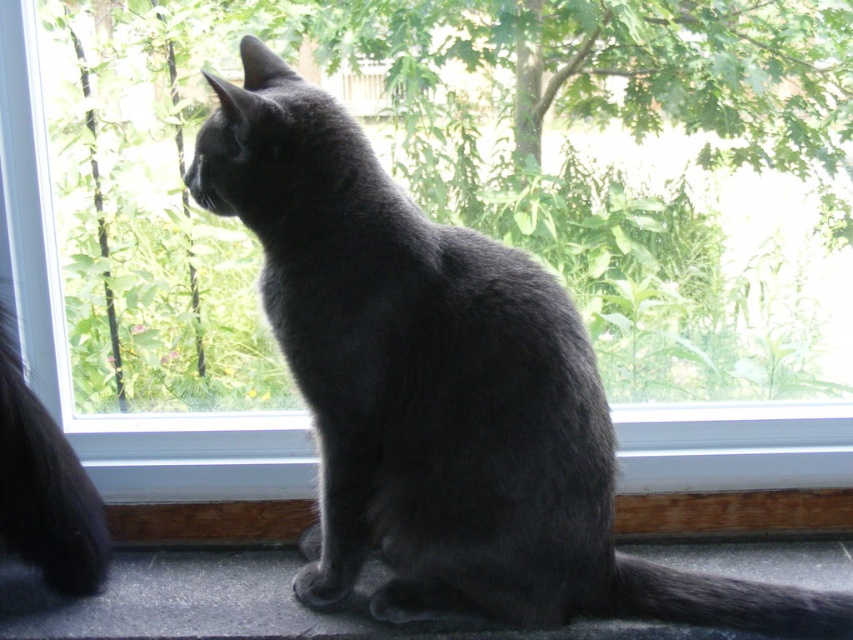
Can you confirm if shiny black cat at center is positioned above shiny black fur at left?

Yes.

Based on the photo, who is higher up, shiny black cat at center or shiny black fur at left?

Positioned higher is shiny black cat at center.

Is point (503, 339) more distant than point (84, 540)?

No, it is not.

I want to click on shiny black cat at center, so click(440, 392).

Which is in front, point (844, 586) or point (44, 448)?

Positioned in front is point (44, 448).

Can you confirm if matte gray cat at lower center is shorter than shiny black fur at left?

Indeed, matte gray cat at lower center has a lesser height compared to shiny black fur at left.

Between point (370, 582) and point (18, 420), which one is positioned in front?

Point (18, 420) is in front.

Locate an element on the screen. matte gray cat at lower center is located at coordinates (242, 604).

Does shiny black cat at center appear over matte gray cat at lower center?

Correct, shiny black cat at center is located above matte gray cat at lower center.

Is point (465, 330) positioned after point (791, 572)?

No, (465, 330) is closer to viewer.

Is point (434, 403) more distant than point (161, 552)?

No.

Where is `shiny black cat at center`? shiny black cat at center is located at coordinates (440, 392).